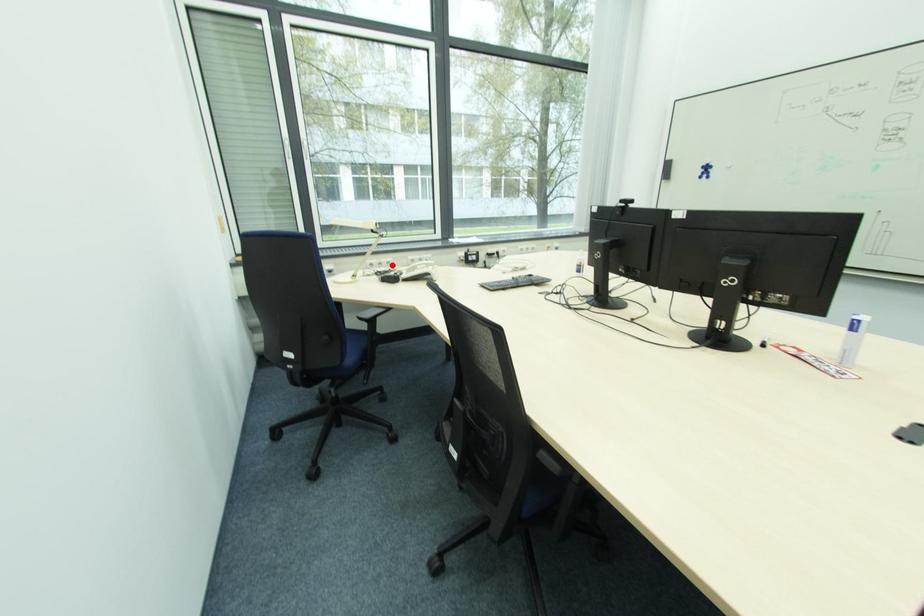
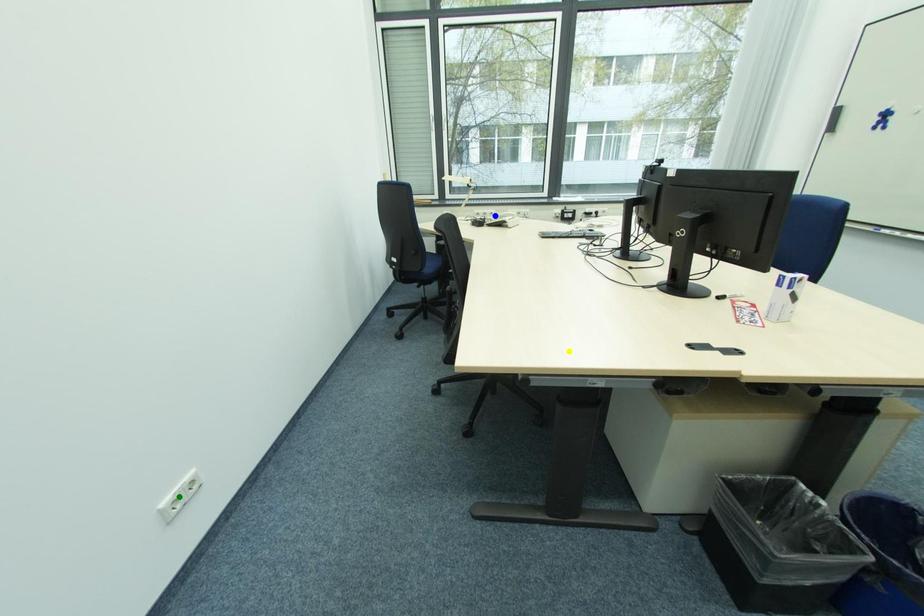
Question: I am providing you with two images of the same scene from different viewpoints. A red point is marked on the first image. You are given multiple points on the second image. Can you choose the point in image 2 that corresponds to the point in image 1?

Choices:
 (A) green point
 (B) yellow point
 (C) blue point

Answer: (C)